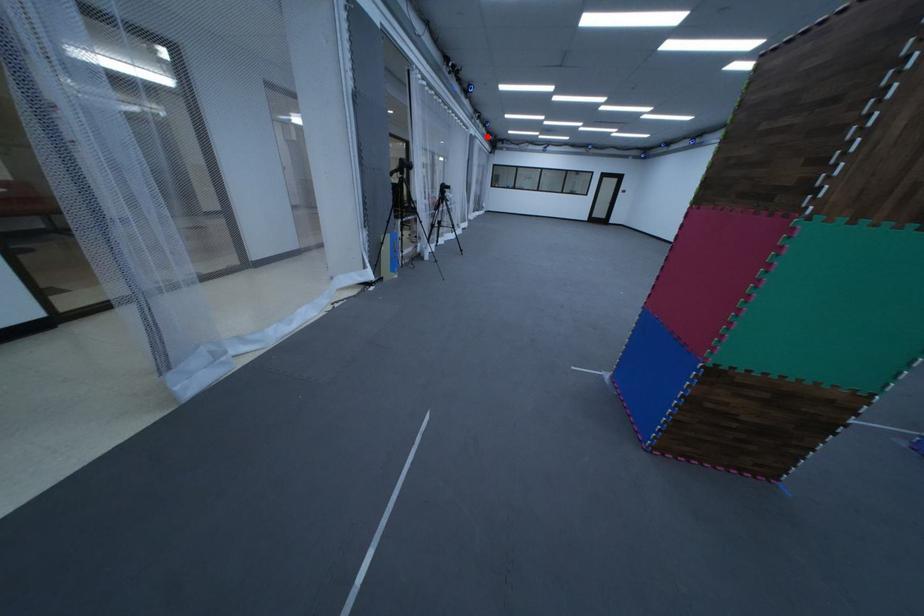
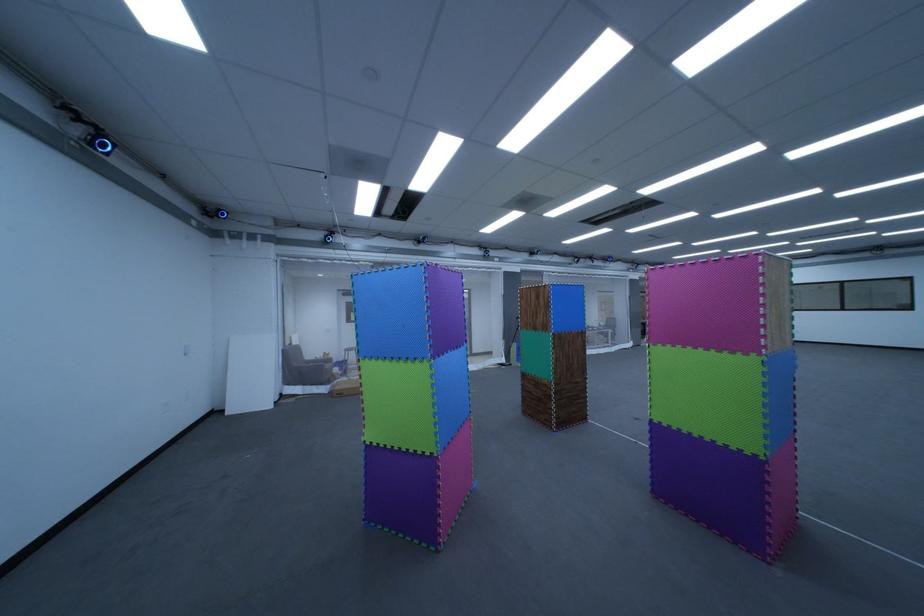
Question: I am providing you with two images of the same scene from different viewpoints. Image1 has a red point marked. In image2, the corresponding 3D location appears at what relative position? Reply with the corresponding letter.

Choices:
 (A) Closer
 (B) Farther

Answer: (B)